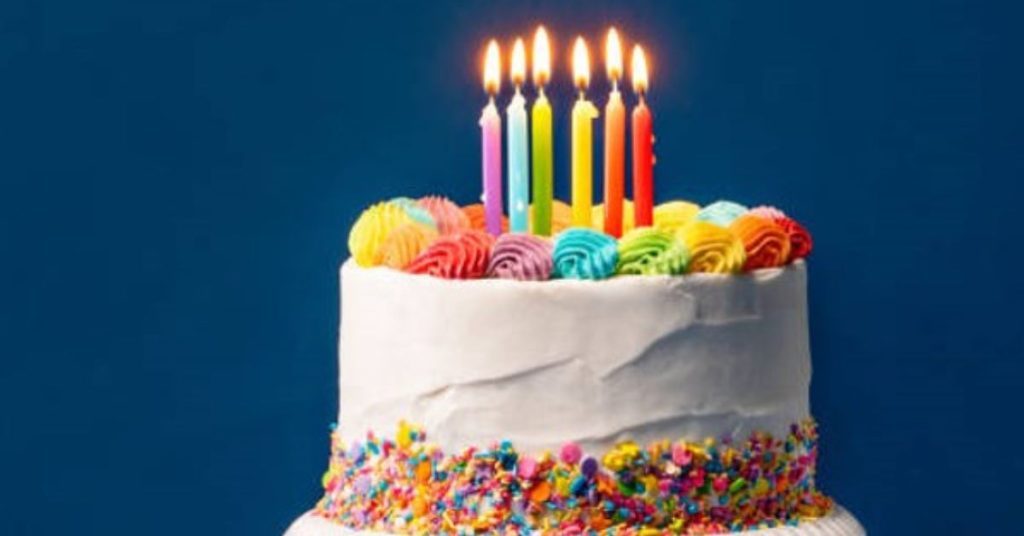
Where is `candle flames`? candle flames is located at coordinates (493, 66), (515, 61), (539, 53), (579, 59), (609, 49), (639, 68).